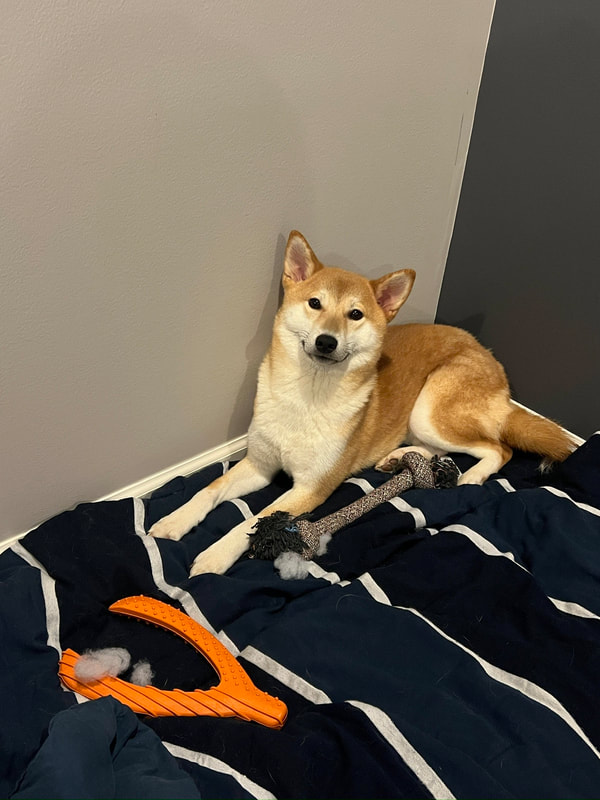
This screenshot has height=800, width=600. I want to click on black wall, so click(x=528, y=270).